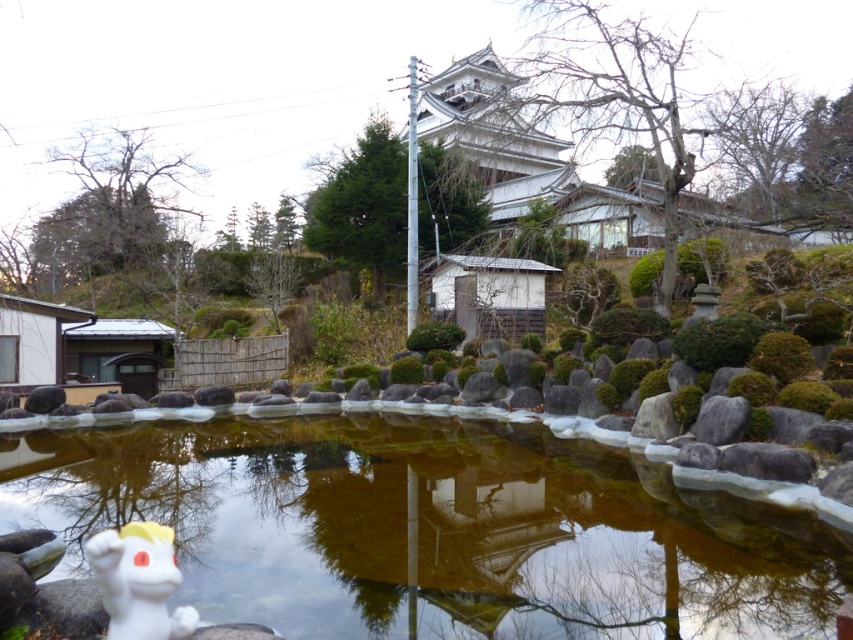
Question: Among these objects, which one is nearest to the camera?

Choices:
 (A) white matte dragon at lower left
 (B) clear glass water at center

Answer: (A)

Question: Considering the relative positions of clear glass water at center and white matte dragon at lower left in the image provided, where is clear glass water at center located with respect to white matte dragon at lower left?

Choices:
 (A) above
 (B) below

Answer: (B)

Question: Is clear glass water at center below white matte dragon at lower left?

Choices:
 (A) yes
 (B) no

Answer: (A)

Question: Is clear glass water at center smaller than white matte dragon at lower left?

Choices:
 (A) yes
 (B) no

Answer: (B)

Question: Which point appears farthest from the camera in this image?

Choices:
 (A) click(x=793, y=616)
 (B) click(x=126, y=609)

Answer: (A)